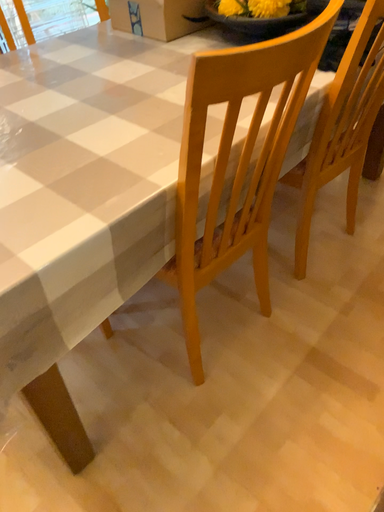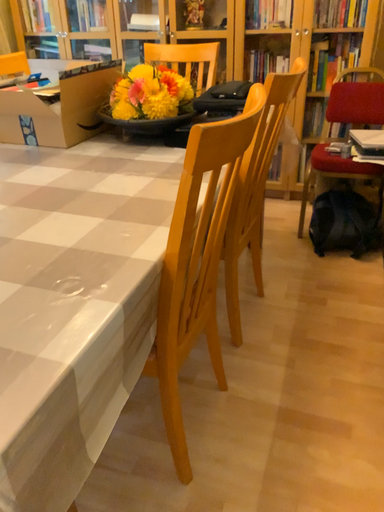
Question: Which way did the camera rotate in the video?

Choices:
 (A) rotated right
 (B) rotated left

Answer: (A)